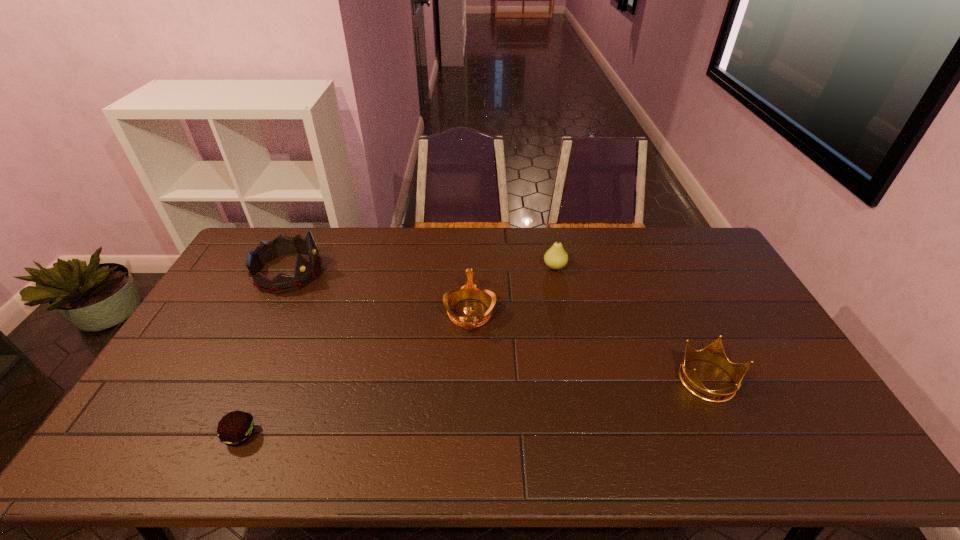
In the image, there is a desktop. Where is `blank space at the near edge`? This screenshot has height=540, width=960. blank space at the near edge is located at coordinates (665, 448).

Where is `vacant area at the left edge of the desktop`? Image resolution: width=960 pixels, height=540 pixels. vacant area at the left edge of the desktop is located at coordinates (207, 336).

Find the location of a particular element. vacant position at the right edge of the desktop is located at coordinates (751, 340).

Find the location of `vacant area that lies between the crown and the left tiara`. vacant area that lies between the crown and the left tiara is located at coordinates (498, 327).

Locate an element on the screen. This screenshot has width=960, height=540. free spot between the taller tiara and the fourth object from left to right is located at coordinates (421, 269).

In order to click on free area in between the shortest object and the tallest object in this screenshot , I will do `click(264, 354)`.

Identify the location of free point between the taller tiara and the right tiara. This screenshot has width=960, height=540. 379,293.

Identify the location of empty space that is in between the fourth farthest object and the pear. The width and height of the screenshot is (960, 540). (632, 324).

At what (x,y) coordinates should I click in order to perform the action: click on unoccupied area between the second object from right to left and the patty. Please return your answer as a coordinate pair (x, y). Image resolution: width=960 pixels, height=540 pixels. Looking at the image, I should click on (397, 351).

Where is `vacant area between the nearest object and the right tiara`? vacant area between the nearest object and the right tiara is located at coordinates (355, 374).